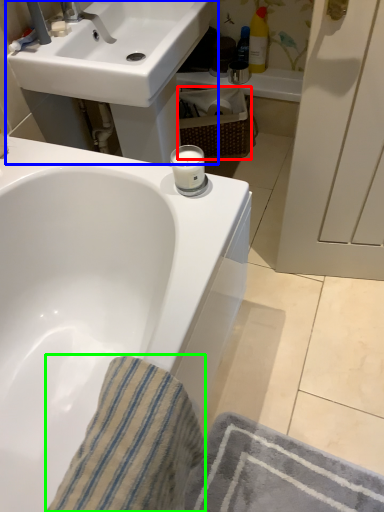
Question: Which object is positioned closest to basket (highlighted by a red box)? Select from sink (highlighted by a blue box) and bath towel (highlighted by a green box).

Choices:
 (A) sink
 (B) bath towel

Answer: (A)